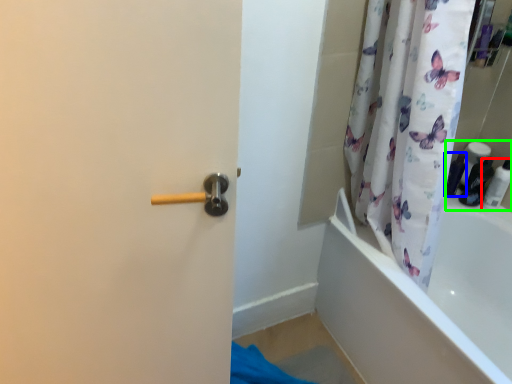
Question: Estimate the real-world distances between objects in this image. Which object is farther from toiletry (highlighted by a red box), toiletry (highlighted by a blue box) or toiletry (highlighted by a green box)?

Choices:
 (A) toiletry
 (B) toiletry

Answer: (A)